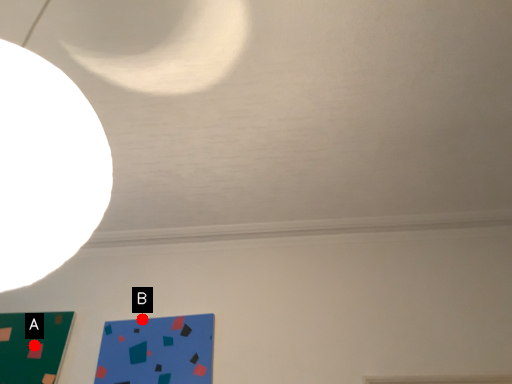
Question: Two points are circled on the image, labeled by A and B beside each circle. Which point appears farthest from the camera in this image?

Choices:
 (A) A is further
 (B) B is further

Answer: (B)